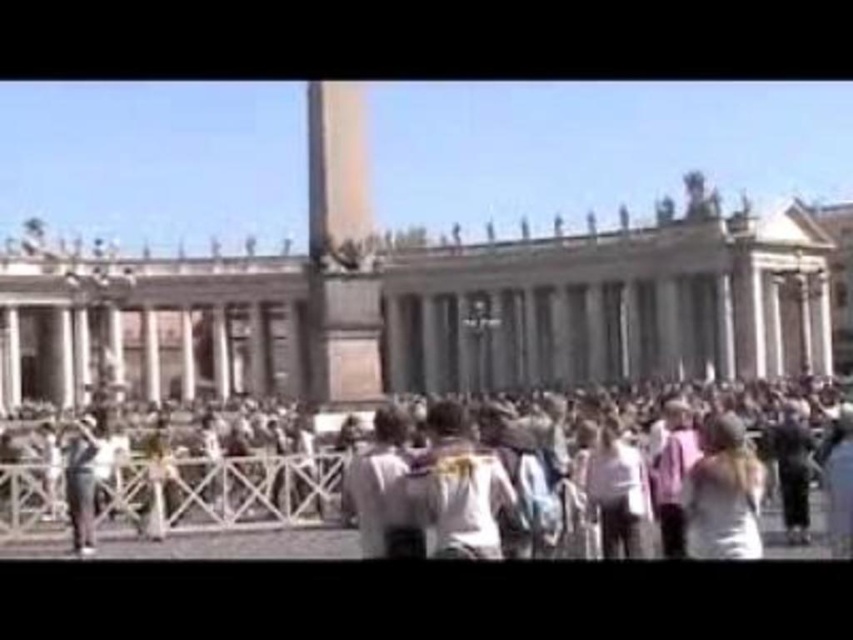
You are standing at point (733, 461) and want to walk to the obelisk in the center. Is there a clear path from your current position to the obelisk without passing through point (514, 266)?

Since point (514, 266) is behind point (733, 461), you can walk towards the obelisk in the center without passing through point (514, 266).

You are standing at the entrance of the grand structure and want to locate the stone columns at center. According to the coordinates provided, where should you look to find them?

The stone columns at center are located at coordinates point (438, 314), so you should look towards the center of the structure where those coordinates are marked.

You are standing in front of the grand building and notice two points marked in the scene. Which of the two points, point (491, 476) or point (614, 502), is closer to you?

Point (491, 476) is closer to the viewer than point (614, 502).